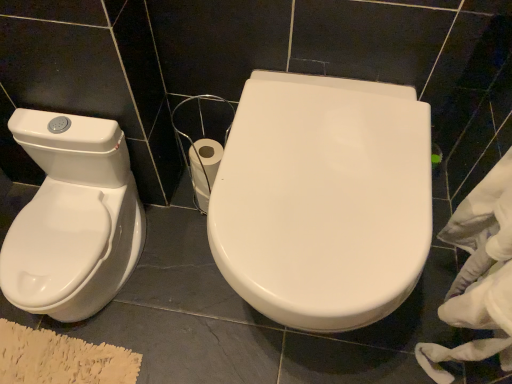
Where is `empty space that is ontop of white glossy toilet seat at center`? This screenshot has height=384, width=512. empty space that is ontop of white glossy toilet seat at center is located at coordinates (330, 177).